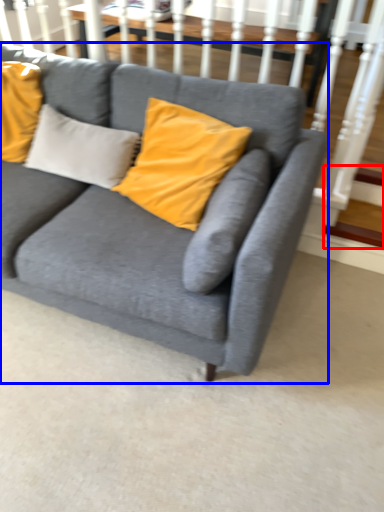
Question: Among these objects, which one is nearest to the camera, stairs (highlighted by a red box) or studio couch (highlighted by a blue box)?

Choices:
 (A) stairs
 (B) studio couch

Answer: (B)